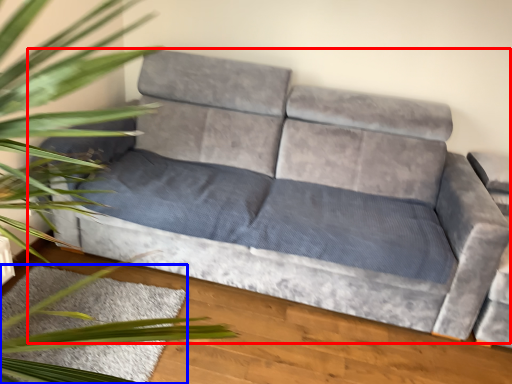
Question: Which object is closer to the camera taking this photo, studio couch (highlighted by a red box) or mat (highlighted by a blue box)?

Choices:
 (A) studio couch
 (B) mat

Answer: (A)